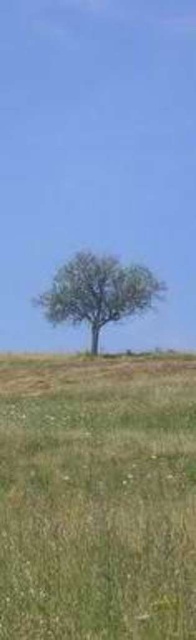
Question: Which of the following is the closest to the observer?

Choices:
 (A) (173, 364)
 (B) (67, 275)

Answer: (A)

Question: Where is green grassy field at center located in relation to green leafy tree at center in the image?

Choices:
 (A) above
 (B) below

Answer: (B)

Question: Which point is closer to the camera taking this photo?

Choices:
 (A) (75, 390)
 (B) (89, 273)

Answer: (A)

Question: Among these points, which one is nearest to the camera?

Choices:
 (A) (70, 376)
 (B) (140, 278)

Answer: (A)

Question: Is green grassy field at center wider than green leafy tree at center?

Choices:
 (A) yes
 (B) no

Answer: (B)

Question: Can you confirm if green grassy field at center is positioned below green leafy tree at center?

Choices:
 (A) yes
 (B) no

Answer: (A)